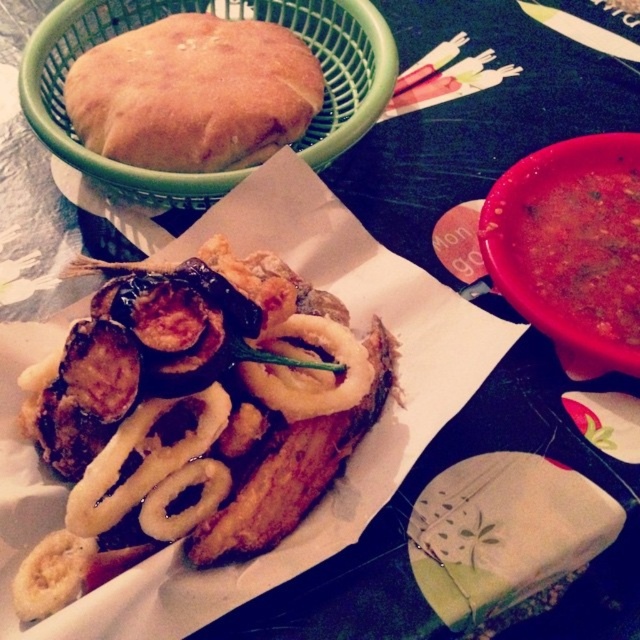
You are a food critic who wants to dip the golden crispy onion rings at center into the sauce. However, you notice the golden brown bread at upper left is blocking your way. Can you move the bread to access the sauce?

The golden crispy onion rings at center is positioned under golden brown bread at upper left, so you cannot move the bread as it is not above the onion rings but rather blocking the path. You might need to adjust the bread to access the sauce.

You are a food delivery person who needs to place a small napkin under the golden crispy onion rings at center to prevent it from getting soggy. Based on the image, where should you place the napkin relative to the other items on the plate?

The golden crispy onion rings at center is located at point (193, 416), so you should place the napkin directly under that position to protect it from the other items.